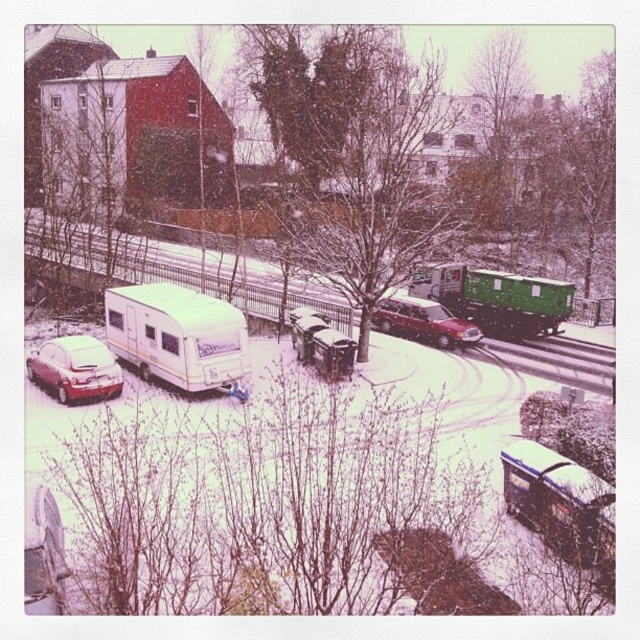
Consider the image. Does metallic silver trailer at lower right appear under green matte trailer at center?

Yes.

Can you confirm if metallic silver trailer at lower right is smaller than green matte trailer at center?

Yes.

Who is more forward, (x=572, y=544) or (x=492, y=285)?

Point (x=572, y=544) is more forward.

This screenshot has height=640, width=640. I want to click on metallic silver trailer at lower right, so click(x=560, y=500).

Is white glossy caravan at center-left to the left of green matte trailer at center from the viewer's perspective?

Yes, white glossy caravan at center-left is to the left of green matte trailer at center.

Does white glossy caravan at center-left have a lesser width compared to green matte trailer at center?

Correct, white glossy caravan at center-left's width is less than green matte trailer at center's.

Where is `white glossy caravan at center-left`? white glossy caravan at center-left is located at coordinates (177, 336).

Is green matte trailer at center shorter than metal train track at center?

In fact, green matte trailer at center may be taller than metal train track at center.

From the picture: Is green matte trailer at center below metal train track at center?

Incorrect, green matte trailer at center is not positioned below metal train track at center.

This screenshot has width=640, height=640. What do you see at coordinates (497, 298) in the screenshot? I see `green matte trailer at center` at bounding box center [497, 298].

I want to click on green matte trailer at center, so (x=497, y=298).